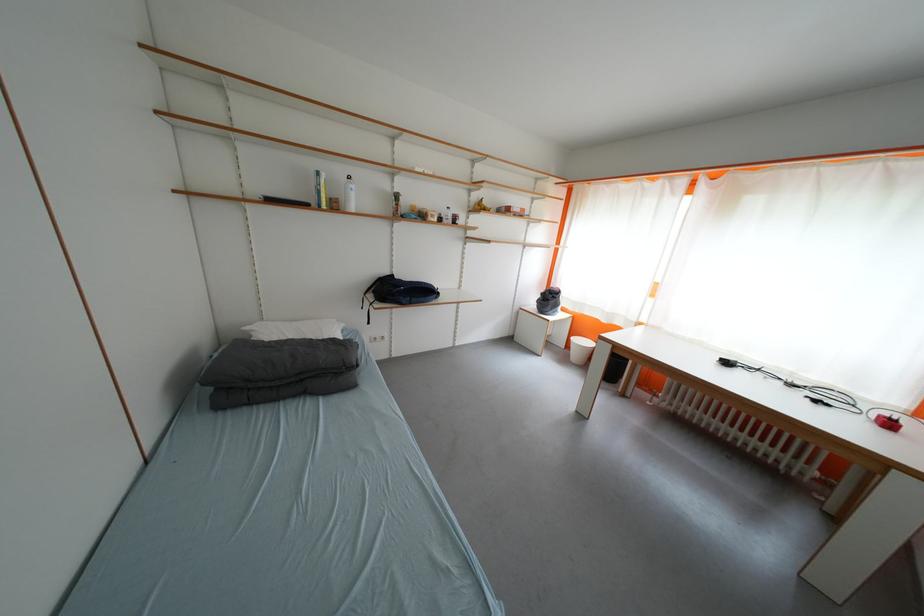
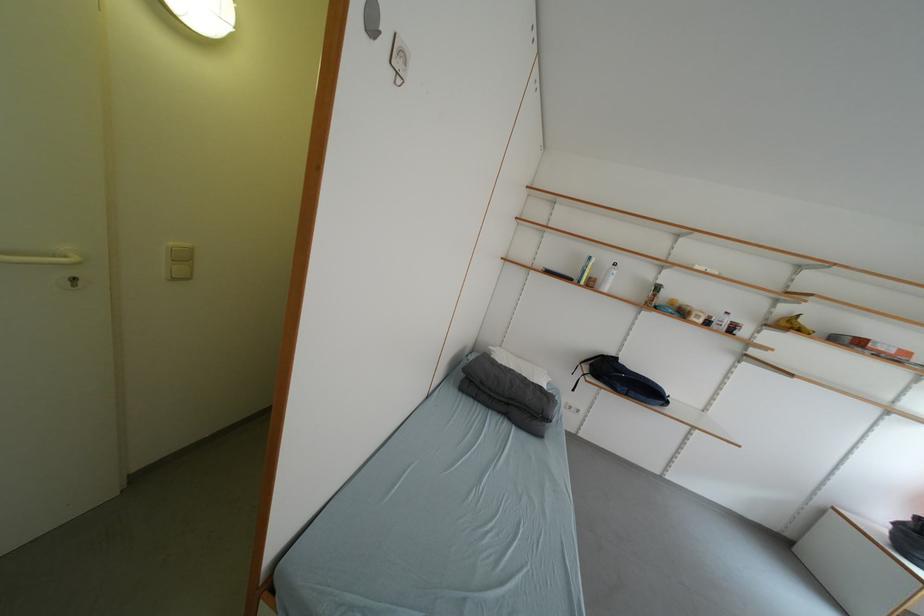
The point at [488,211] is marked in the first image. Where is the corresponding point in the second image?

(797, 328)